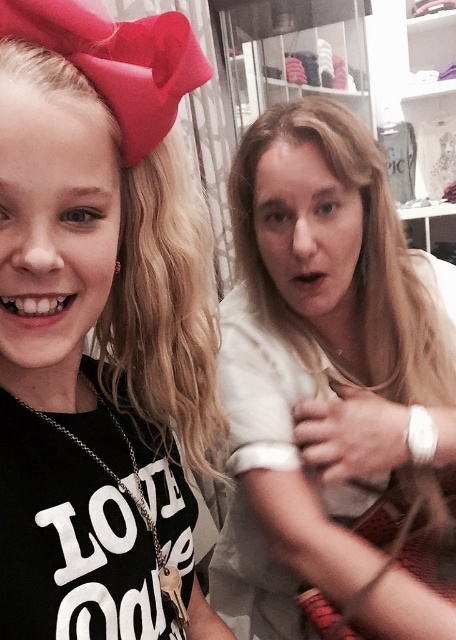
Based on the scene description, where is the white matte shirt at center located in terms of coordinates?

The white matte shirt at center is located at point coordinates of 0.616 on the x axis and 0.730 on the y axis.

You are a photographer taking a portrait of two people. You need to ensure that the white matte shirt at center and the blonde curly hair at upper left are both visible in the frame. Based on their positions, which object should be placed closer to the right edge of the photo?

The white matte shirt at center is positioned on the right side of blonde curly hair at upper left, so the white matte shirt at center should be placed closer to the right edge of the photo.

You are designing a layout for a magazine cover. The magazine requires that the main subject should be the larger of the two elements. Given the white matte shirt at center and the blonde curly hair at upper left, which element should you focus on as the main subject?

The white matte shirt at center should be the main subject because it has a larger size compared to the blonde curly hair at upper left.